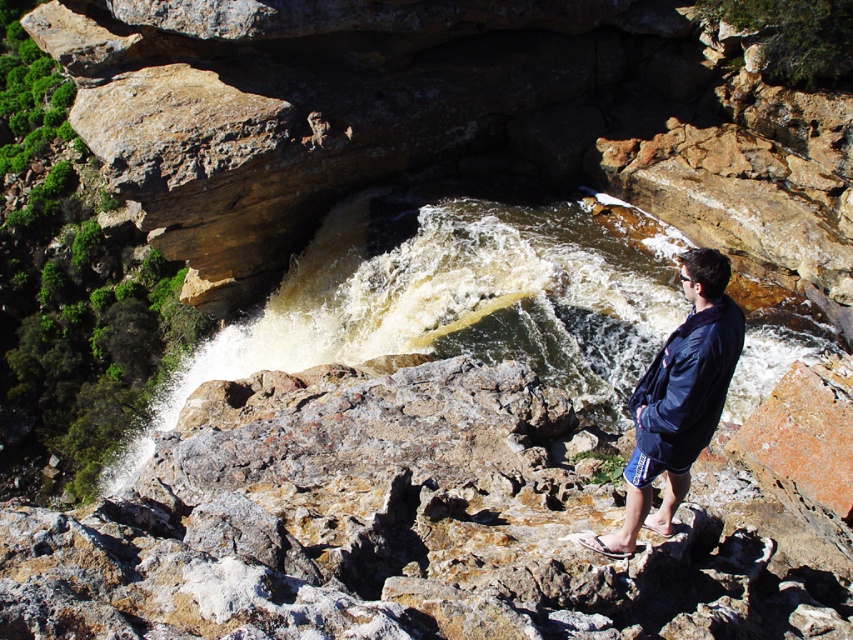
Question: Which point is closer to the camera?

Choices:
 (A) brown/rocky water at center
 (B) black rubber sandal at lower right
 (C) dark blue fabric at center

Answer: (C)

Question: Does dark blue fabric at center have a lesser width compared to black rubber sandal at lower right?

Choices:
 (A) no
 (B) yes

Answer: (A)

Question: Is brown/rocky water at center bigger than black rubber sandal at lower right?

Choices:
 (A) no
 (B) yes

Answer: (B)

Question: Which object appears farthest from the camera in this image?

Choices:
 (A) black rubber sandal at lower right
 (B) brown/rocky water at center
 (C) dark blue fabric at center

Answer: (B)

Question: Among these points, which one is nearest to the camera?

Choices:
 (A) (595, 548)
 (B) (560, 387)
 (C) (637, 506)

Answer: (A)

Question: Is brown/rocky water at center above dark blue fabric at center?

Choices:
 (A) yes
 (B) no

Answer: (A)